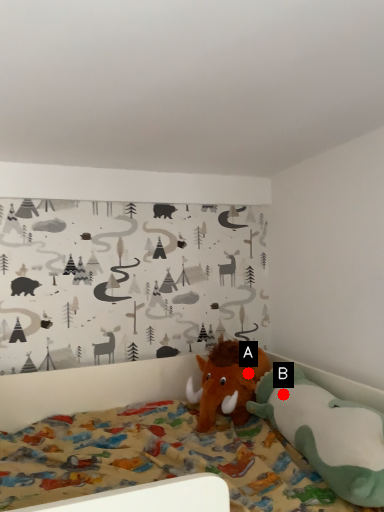
Question: Two points are circled on the image, labeled by A and B beside each circle. Which point is closer to the camera?

Choices:
 (A) A is closer
 (B) B is closer

Answer: (B)